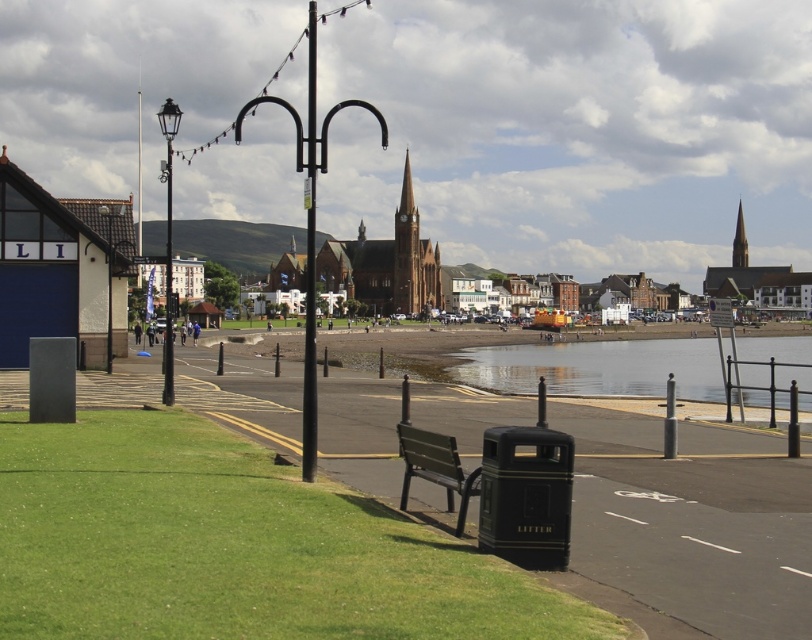
Which is in front, point (312, 387) or point (400, 305)?

Point (312, 387) is more forward.

Between metallic pole at center and brown stone spire at center, which one appears on the left side from the viewer's perspective?

metallic pole at center is more to the left.

Find the location of `metallic pole at center`. metallic pole at center is located at coordinates (309, 266).

Where is `metallic pole at center`? The height and width of the screenshot is (640, 812). metallic pole at center is located at coordinates (309, 266).

Does point (309, 250) come in front of point (396, 429)?

Yes, point (309, 250) is closer to viewer.

Is metallic pole at center below wooden bench at center?

Actually, metallic pole at center is above wooden bench at center.

Which is behind, point (304, 397) or point (400, 504)?

Positioned behind is point (304, 397).

Find the location of `metallic pole at center`. metallic pole at center is located at coordinates tap(309, 266).

Can you confirm if clear water at lower center is thinner than wooden bench at center?

No, clear water at lower center is not thinner than wooden bench at center.

In the scene shown: Is clear water at lower center above wooden bench at center?

Incorrect, clear water at lower center is not positioned above wooden bench at center.

Which is behind, point (672, 356) or point (451, 480)?

Positioned behind is point (672, 356).

Where is `clear water at lower center`? Image resolution: width=812 pixels, height=640 pixels. clear water at lower center is located at coordinates (598, 368).